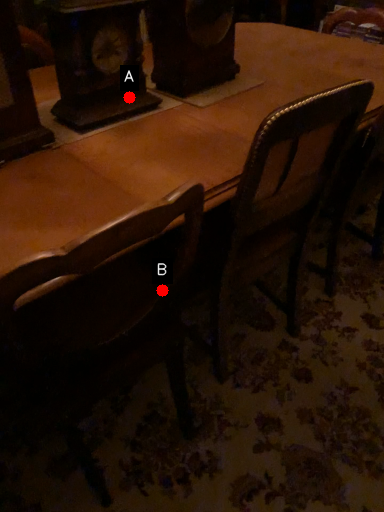
Question: Two points are circled on the image, labeled by A and B beside each circle. Which of the following is the closest to the observer?

Choices:
 (A) A is closer
 (B) B is closer

Answer: (B)